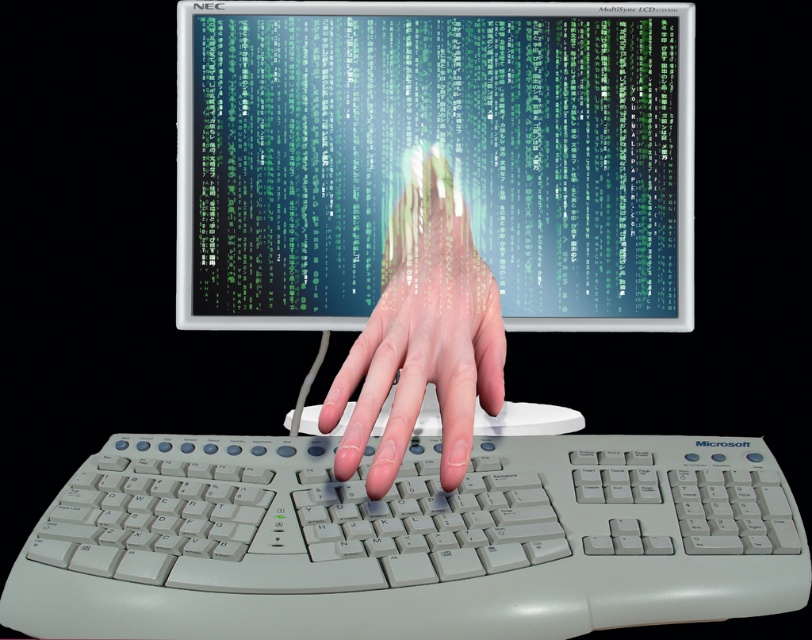
Question: Which object is closer to the camera taking this photo?

Choices:
 (A) green matrix code at center
 (B) translucent skin hand at center

Answer: (B)

Question: Is green matrix code at center positioned at the back of translucent skin hand at center?

Choices:
 (A) no
 (B) yes

Answer: (B)

Question: Observing the image, what is the correct spatial positioning of green matrix code at center in reference to translucent skin hand at center?

Choices:
 (A) above
 (B) below

Answer: (A)

Question: Which point appears farthest from the camera in this image?

Choices:
 (A) (467, 307)
 (B) (201, 477)

Answer: (A)

Question: Is green matrix code at center positioned in front of translucent skin hand at center?

Choices:
 (A) yes
 (B) no

Answer: (B)

Question: Which object is closer to the camera taking this photo?

Choices:
 (A) white plastic keyboard at center
 (B) translucent skin hand at center
 (C) green matrix code at center

Answer: (A)